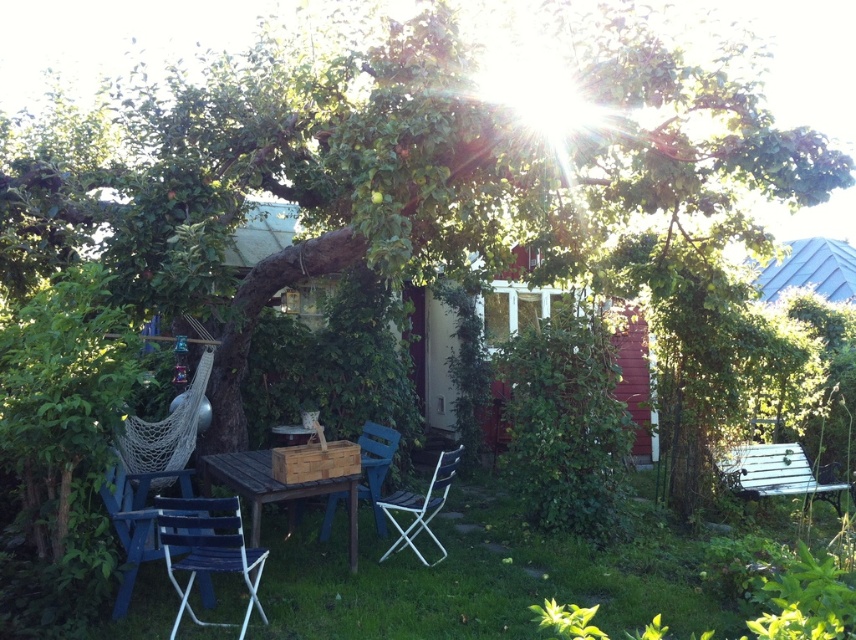
Who is taller, wooden table at center or metallic silver chair at lower center?

With more height is wooden table at center.

Who is more forward, [204,483] or [459,454]?

Point [459,454] is in front.

At what (x,y) coordinates should I click in order to perform the action: click on wooden table at center. Please return your answer as a coordinate pair (x, y). Looking at the image, I should click on (275, 490).

Does blue corrugated metal hut at upper right appear under blue wood chair at center?

No, blue corrugated metal hut at upper right is not below blue wood chair at center.

Which is more to the right, blue corrugated metal hut at upper right or blue wood chair at center?

Positioned to the right is blue corrugated metal hut at upper right.

Image resolution: width=856 pixels, height=640 pixels. I want to click on blue corrugated metal hut at upper right, so click(x=811, y=269).

Is wooden hut at center smaller than blue corrugated metal hut at upper right?

Yes.

Between wooden hut at center and blue corrugated metal hut at upper right, which one has less height?

With less height is blue corrugated metal hut at upper right.

Find the location of a particular element. wooden hut at center is located at coordinates [x=432, y=358].